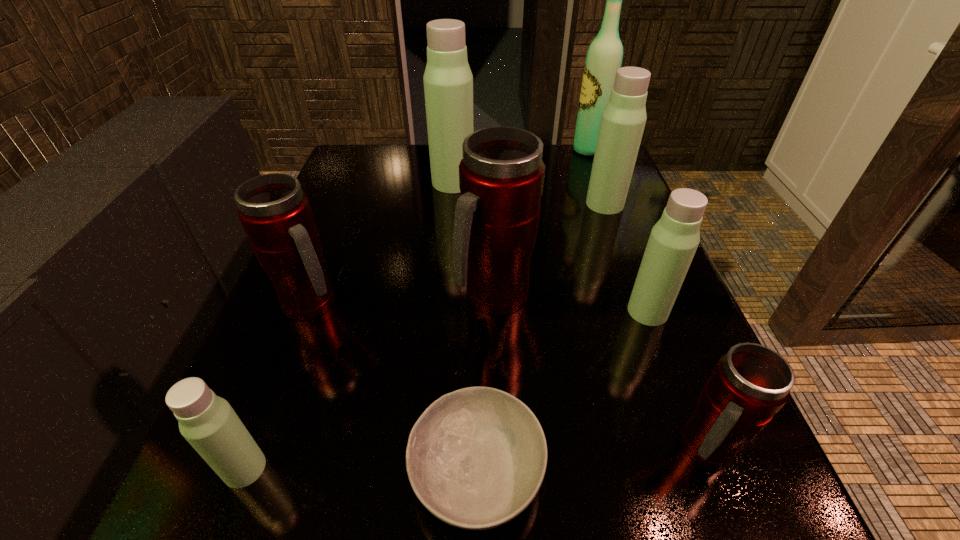
You are a GUI agent. You are given a task and a screenshot of the screen. Output one action in this format:
    pyautogui.click(x=<x>, y=<y>)
    Task: Click on the thermos bottle identified as the fourth closest to the third nearest light thermos bottle
    
    Given the screenshot: What is the action you would take?
    pyautogui.click(x=751, y=383)

You are a GUI agent. You are given a task and a screenshot of the screen. Output one action in this format:
    pyautogui.click(x=<x>, y=<y>)
    Task: Click on the sixth closest thermos bottle to the third biggest light thermos bottle
    
    Given the screenshot: What is the action you would take?
    pyautogui.click(x=208, y=422)

Identify which light thermos bottle is located as the second nearest to the tallest thermos bottle. Please provide its 2D coordinates. Your answer should be formatted as a tuple, i.e. [(x, y)], where the tuple contains the x and y coordinates of a point satisfying the conditions above.

[(673, 241)]

Image resolution: width=960 pixels, height=540 pixels. In order to click on light thermos bottle that is the closest to the white wine bottle in this screenshot , I will do `click(623, 120)`.

Point out which red thermos bottle is positioned as the third nearest to the bowl. Please provide its 2D coordinates. Your answer should be formatted as a tuple, i.e. [(x, y)], where the tuple contains the x and y coordinates of a point satisfying the conditions above.

[(275, 213)]

Identify which red thermos bottle is the closest to the leftmost red thermos bottle. Please provide its 2D coordinates. Your answer should be formatted as a tuple, i.e. [(x, y)], where the tuple contains the x and y coordinates of a point satisfying the conditions above.

[(501, 176)]

This screenshot has height=540, width=960. Find the location of `vacant point that satisfies the following two spatial constraints: 1. on the side with the handle of the second biggest red thermos bottle; 2. on the back side of the third biggest light thermos bottle`. vacant point that satisfies the following two spatial constraints: 1. on the side with the handle of the second biggest red thermos bottle; 2. on the back side of the third biggest light thermos bottle is located at coordinates (309, 312).

Image resolution: width=960 pixels, height=540 pixels. I want to click on vacant space that satisfies the following two spatial constraints: 1. on the front-facing side of the wine bottle; 2. on the front side of the third farthest light thermos bottle, so click(x=649, y=312).